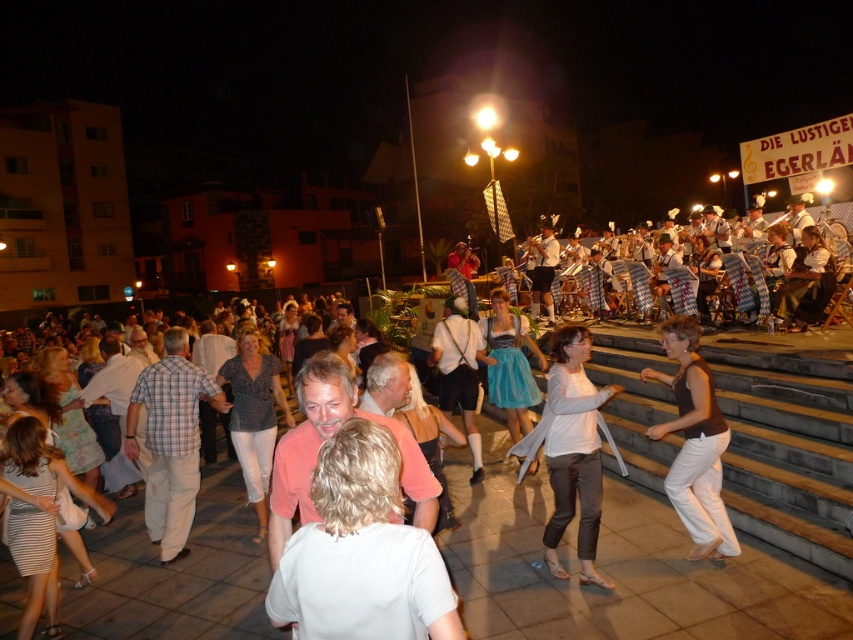
You are a photographer trying to capture both the patterned fabric blouse at center and the blue satin dirndl at center in the same frame. Which clothing item should you focus on first to ensure both are in the frame without moving the camera?

The patterned fabric blouse at center is taller than the blue satin dirndl at center. To ensure both are in frame, focus on the taller item first, which is the patterned fabric blouse at center, then adjust the camera angle slightly downward to include the blue satin dirndl at center without moving the camera.

You are a photographer at the event and want to capture both the patterned fabric blouse at center and the blue satin dirndl at center in a single frame. Which clothing item will appear wider in the photo?

The blue satin dirndl at center will appear wider in the photo because it has a greater width than the patterned fabric blouse at center.

You are standing at the center of the plaza and want to take a photo of the patterned fabric blouse at center. Which direction should you face to ensure it is in the center of your camera view?

To take a photo of the patterned fabric blouse at center, you should face directly towards the center of the plaza, as the blouse is located at the central point of the scene.